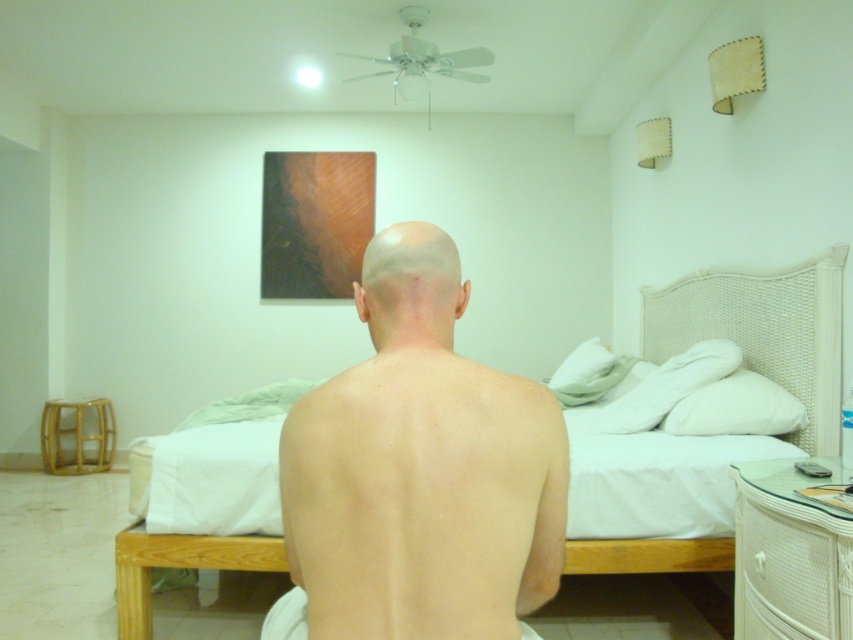
You are a delivery person who needs to place a large package on the floor near the white woven bed at center and the white wicker dresser at lower right. Which object should you place the package closer to if you want it to be near the taller object?

The white woven bed at center is much taller than the white wicker dresser at lower right, so you should place the package closer to the white woven bed at center.

You are a photographer setting up a shoot in this room. You need to position the skinny bald man at center so that he is the same height in the photo as the white wicker dresser at lower right. Given their actual sizes, is this possible?

The skinny bald man at center has a smaller size compared to white wicker dresser at lower right. To make them appear the same height in the photo, the man should be placed closer to the camera while the dresser remains farther away.